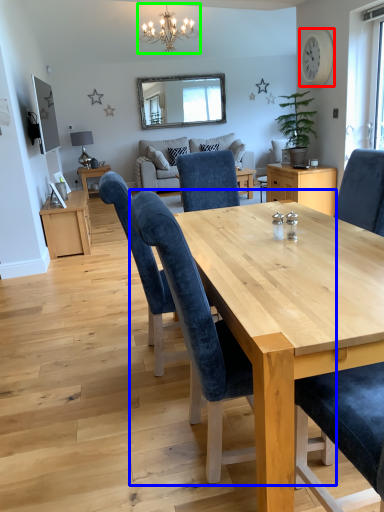
Question: Which is nearer to the clock (highlighted by a red box)? chair (highlighted by a blue box) or light fixture (highlighted by a green box).

Choices:
 (A) chair
 (B) light fixture

Answer: (B)